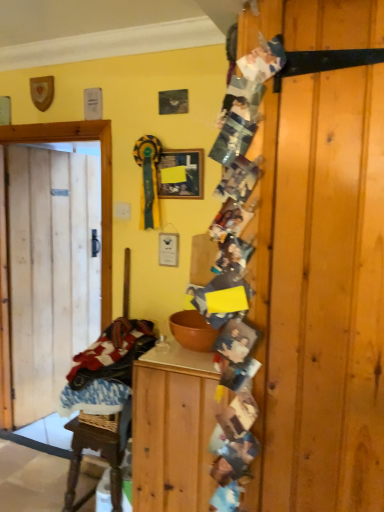
Question: Is the depth of wooden cabinet at center greater than that of natural wood door at left?

Choices:
 (A) yes
 (B) no

Answer: (B)

Question: From a real-world perspective, is wooden cabinet at center physically below natural wood door at left?

Choices:
 (A) no
 (B) yes

Answer: (B)

Question: Does wooden cabinet at center have a lesser width compared to natural wood door at left?

Choices:
 (A) no
 (B) yes

Answer: (A)

Question: Can you confirm if wooden cabinet at center is bigger than natural wood door at left?

Choices:
 (A) no
 (B) yes

Answer: (B)

Question: From the image's perspective, is wooden cabinet at center over natural wood door at left?

Choices:
 (A) no
 (B) yes

Answer: (A)

Question: Is the position of wooden cabinet at center less distant than that of natural wood door at left?

Choices:
 (A) yes
 (B) no

Answer: (A)

Question: Can we say plaid fabric laundry at left lies outside natural wood door at left?

Choices:
 (A) yes
 (B) no

Answer: (A)

Question: From the image's perspective, is plaid fabric laundry at left on natural wood door at left?

Choices:
 (A) yes
 (B) no

Answer: (B)

Question: Considering the relative sizes of plaid fabric laundry at left and natural wood door at left in the image provided, is plaid fabric laundry at left thinner than natural wood door at left?

Choices:
 (A) yes
 (B) no

Answer: (B)

Question: Could natural wood door at left be considered to be inside plaid fabric laundry at left?

Choices:
 (A) no
 (B) yes

Answer: (A)

Question: Does plaid fabric laundry at left have a smaller size compared to natural wood door at left?

Choices:
 (A) no
 (B) yes

Answer: (B)

Question: From a real-world perspective, is plaid fabric laundry at left below natural wood door at left?

Choices:
 (A) yes
 (B) no

Answer: (A)

Question: Is natural wood door at left at the left side of matte black picture frame at upper center?

Choices:
 (A) yes
 (B) no

Answer: (A)